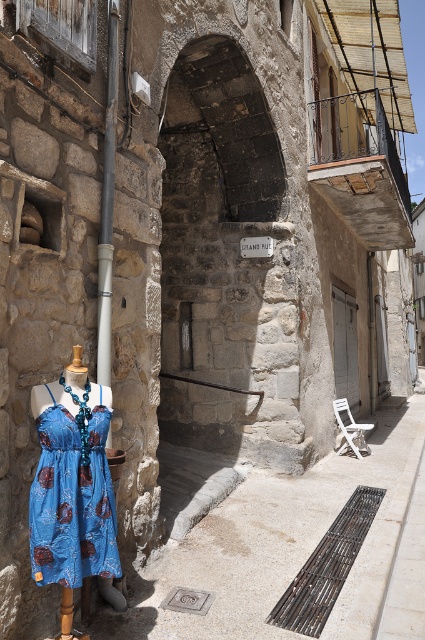
You are a delivery person carrying a box that is 1.5 meters wide. You need to navigate through the narrow street scene shown in the image. Can you pass between the blue printed fabric dress at left and the rusty metal grate at lower center without tilting the box sideways?

The distance between the blue printed fabric dress at left and the rusty metal grate at lower center is 1.63 meters. Since the box is 1.5 meters wide, it can fit through the space as the available width is slightly larger than the box. Therefore, you can pass through without tilting the box sideways.